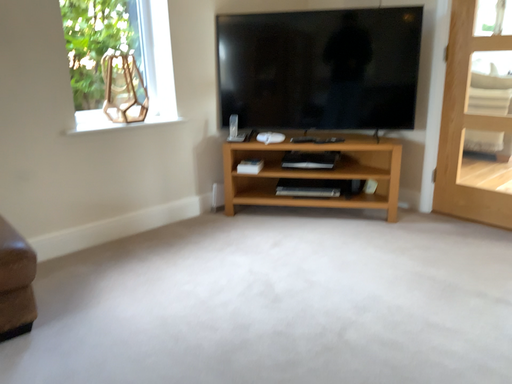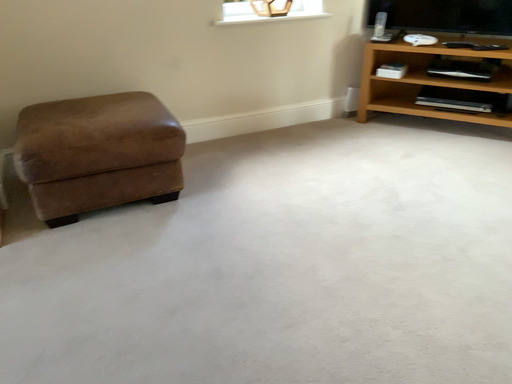
Question: How did the camera likely rotate when shooting the video?

Choices:
 (A) rotated right
 (B) rotated left

Answer: (B)